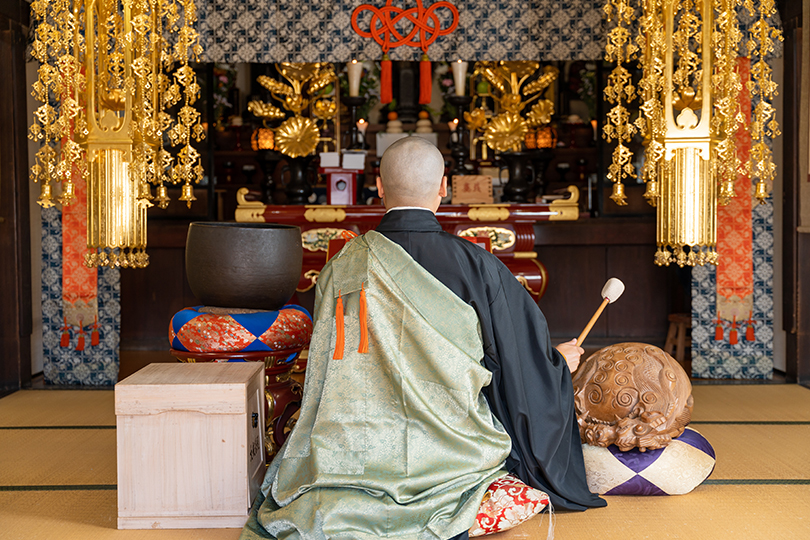
This screenshot has width=810, height=540. I want to click on oversized bowl, like a cauldron, so click(274, 256).